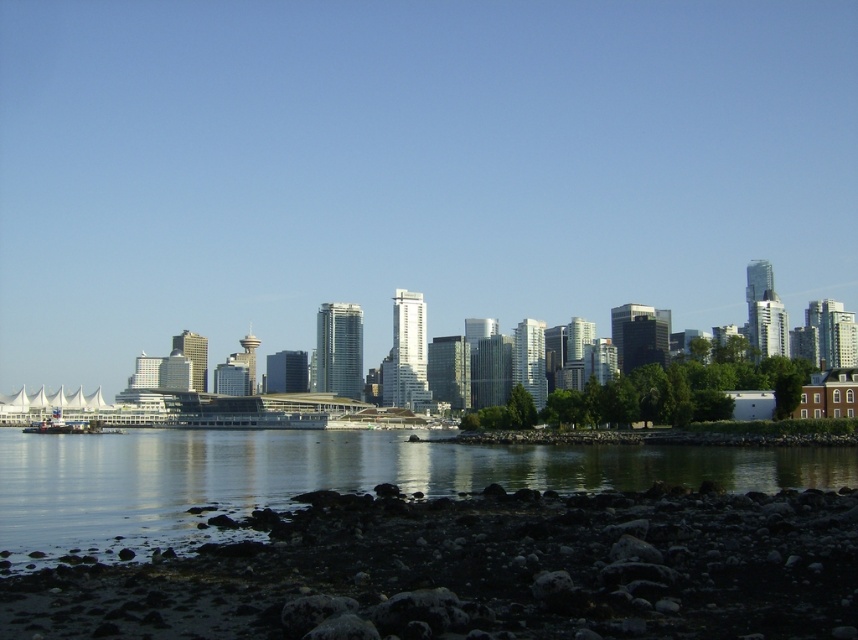
In the scene shown: You are standing at the point marked as point [479,572] in the image. What object are you standing on?

You are standing on the dark gray rocky shore at lower left.

You are a delivery drone with a wingspan of 6 feet. You need to fly from the dark gray rocky shore at lower left to the smooth dark water at lower center. Can you safely navigate the space between them without any obstacles?

The distance between the dark gray rocky shore at lower left and smooth dark water at lower center is 119.65 feet. Since your wingspan is only 6 feet, there is ample space for you to navigate safely between them.